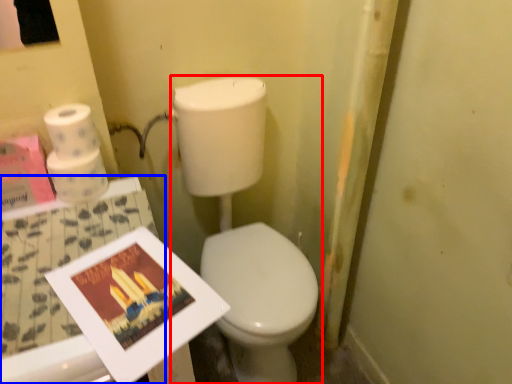
Question: Which point is further to the camera, toiletries (highlighted by a red box) or table (highlighted by a blue box)?

Choices:
 (A) toiletries
 (B) table

Answer: (A)